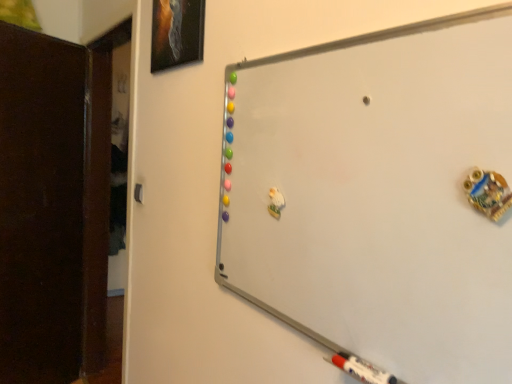
Question: Are dark wood door at left and matte black picture frame at upper left located far from each other?

Choices:
 (A) no
 (B) yes

Answer: (B)

Question: From the image's perspective, is dark wood door at left located beneath matte black picture frame at upper left?

Choices:
 (A) no
 (B) yes

Answer: (B)

Question: Does dark wood door at left come in front of matte black picture frame at upper left?

Choices:
 (A) yes
 (B) no

Answer: (B)

Question: Considering the relative sizes of dark wood door at left and matte black picture frame at upper left in the image provided, is dark wood door at left taller than matte black picture frame at upper left?

Choices:
 (A) yes
 (B) no

Answer: (A)

Question: Is dark wood door at left thinner than matte black picture frame at upper left?

Choices:
 (A) no
 (B) yes

Answer: (A)

Question: Is point (59, 86) positioned closer to the camera than point (431, 364)?

Choices:
 (A) farther
 (B) closer

Answer: (A)

Question: From the image's perspective, is dark wood door at left positioned above or below whiteboard at upper right?

Choices:
 (A) above
 (B) below

Answer: (B)

Question: From a real-world perspective, relative to whiteboard at upper right, is dark wood door at left vertically above or below?

Choices:
 (A) below
 (B) above

Answer: (A)

Question: Is dark wood door at left taller or shorter than whiteboard at upper right?

Choices:
 (A) short
 (B) tall

Answer: (B)

Question: Considering the relative positions of whiteboard at upper right and matte black picture frame at upper left in the image provided, is whiteboard at upper right to the left or to the right of matte black picture frame at upper left?

Choices:
 (A) left
 (B) right

Answer: (B)

Question: Is point (429, 129) positioned closer to the camera than point (166, 11)?

Choices:
 (A) closer
 (B) farther

Answer: (A)

Question: From their relative heights in the image, would you say whiteboard at upper right is taller or shorter than matte black picture frame at upper left?

Choices:
 (A) tall
 (B) short

Answer: (A)

Question: Is whiteboard at upper right bigger or smaller than matte black picture frame at upper left?

Choices:
 (A) small
 (B) big

Answer: (B)

Question: In terms of size, does dark wood door at left appear bigger or smaller than matte black picture frame at upper left?

Choices:
 (A) big
 (B) small

Answer: (A)

Question: In terms of width, does dark wood door at left look wider or thinner when compared to matte black picture frame at upper left?

Choices:
 (A) wide
 (B) thin

Answer: (A)